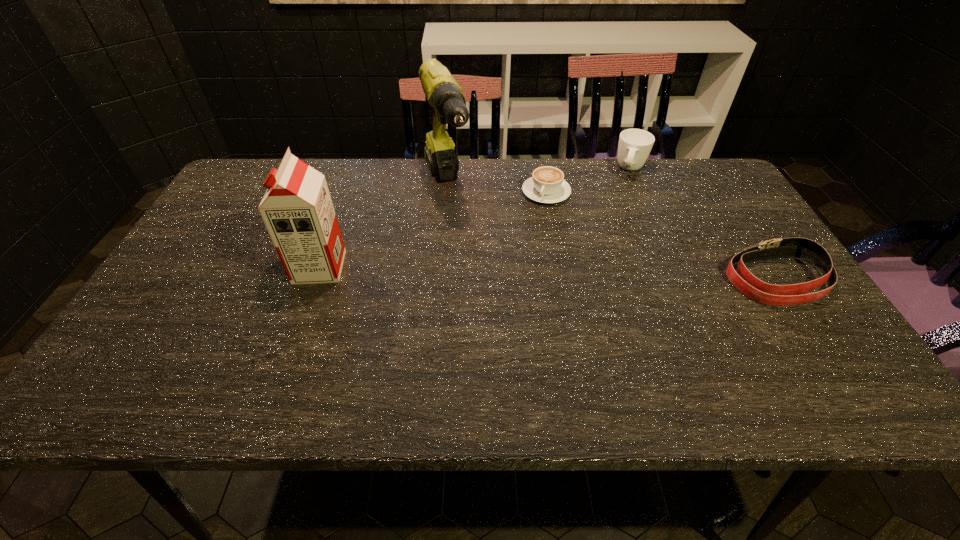
The height and width of the screenshot is (540, 960). What are the coordinates of `free spot on the desktop that is between the soya milk and the dog collar and is positioned on the side of the shortest object with the handle` in the screenshot? It's located at coord(505,272).

Where is `vacant space on the desktop that is between the soya milk and the dog collar and is positioned on the handle side of the drill`? vacant space on the desktop that is between the soya milk and the dog collar and is positioned on the handle side of the drill is located at coordinates (484, 272).

Where is `free space on the desktop that is between the leftmost object and the second shortest object and is positioned with the handle on the side of the cup`? This screenshot has width=960, height=540. free space on the desktop that is between the leftmost object and the second shortest object and is positioned with the handle on the side of the cup is located at coordinates tap(596, 275).